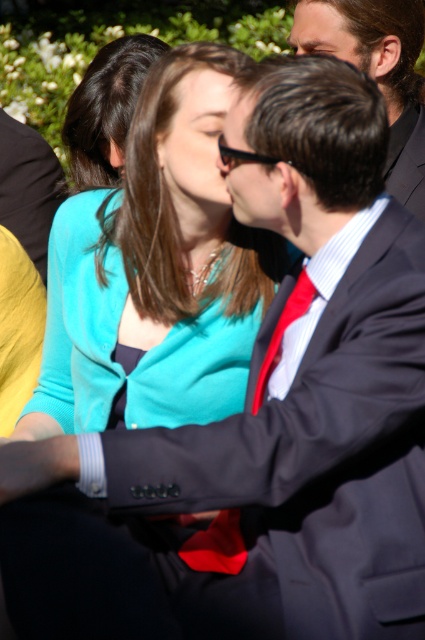
Which is more to the left, matte black suit at center or red silk tie at center?

matte black suit at center

From the picture: Is matte black suit at center thinner than red silk tie at center?

No, matte black suit at center is not thinner than red silk tie at center.

Who is more distant from viewer, (53, 182) or (258, 401)?

The point (53, 182) is behind.

You are a GUI agent. You are given a task and a screenshot of the screen. Output one action in this format:
    pyautogui.click(x=<x>, y=<y>)
    Task: Click on the matte black suit at center
    Image resolution: width=425 pixels, height=640 pixels.
    Given the screenshot: What is the action you would take?
    click(x=28, y=186)